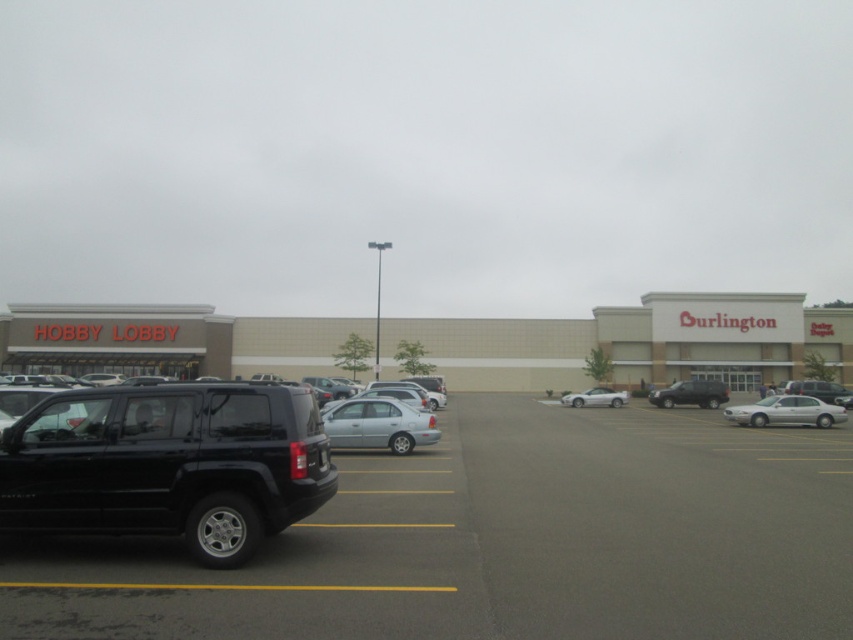
Is black matte suv at lower left to the right of white glossy sedan at right from the viewer's perspective?

Incorrect, black matte suv at lower left is not on the right side of white glossy sedan at right.

Is point (671, 419) closer to camera compared to point (759, 419)?

No, it is behind (759, 419).

Which is behind, point (514, 520) or point (769, 412)?

Point (769, 412)

Where is `black matte suv at lower left`? The height and width of the screenshot is (640, 853). black matte suv at lower left is located at coordinates (502, 541).

Is black matte suv at left to the left of white glossy sedan at center from the viewer's perspective?

Yes, black matte suv at left is to the left of white glossy sedan at center.

Is black matte suv at left positioned in front of white glossy sedan at center?

Yes, black matte suv at left is in front of white glossy sedan at center.

The height and width of the screenshot is (640, 853). I want to click on black matte suv at left, so click(x=167, y=465).

Is beige/light brown building at center bigger than matte black suv at center?

Indeed, beige/light brown building at center has a larger size compared to matte black suv at center.

Which of these two, beige/light brown building at center or matte black suv at center, stands taller?

With more height is beige/light brown building at center.

Image resolution: width=853 pixels, height=640 pixels. What do you see at coordinates (633, 342) in the screenshot?
I see `beige/light brown building at center` at bounding box center [633, 342].

Identify the location of beige/light brown building at center. This screenshot has height=640, width=853. (633, 342).